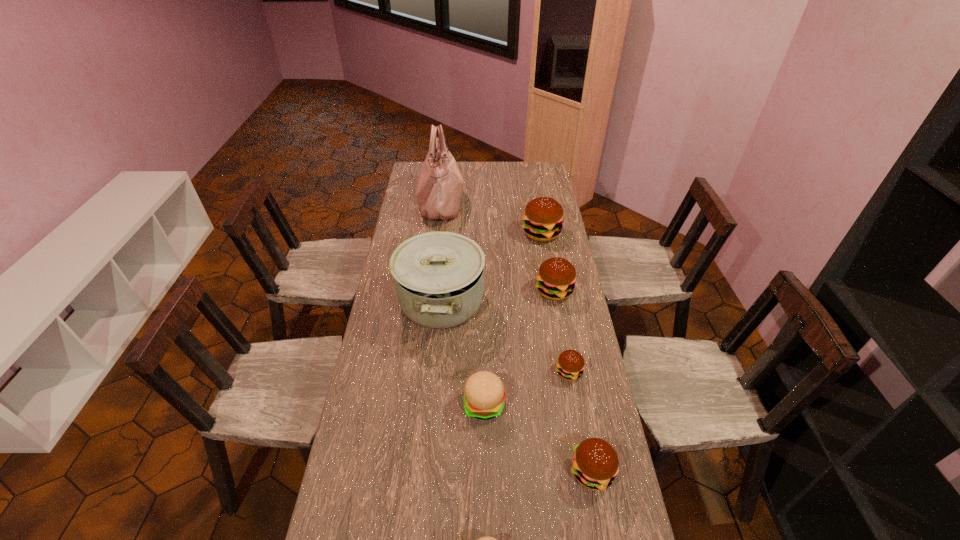
Locate an element on the screen. The height and width of the screenshot is (540, 960). object that is at the far edge is located at coordinates 440,185.

At what (x,y) coordinates should I click in order to perform the action: click on handbag located at the left edge. Please return your answer as a coordinate pair (x, y). Looking at the image, I should click on (440, 185).

At what (x,y) coordinates should I click in order to perform the action: click on saucepan that is at the left edge. Please return your answer as a coordinate pair (x, y). This screenshot has height=540, width=960. Looking at the image, I should click on (439, 276).

Locate an element on the screen. Image resolution: width=960 pixels, height=540 pixels. object that is at the far left corner is located at coordinates (440, 185).

Locate an element on the screen. This screenshot has height=540, width=960. vacant region at the left edge is located at coordinates (368, 391).

Where is `vacant space at the right edge of the desktop`? This screenshot has width=960, height=540. vacant space at the right edge of the desktop is located at coordinates (573, 264).

Image resolution: width=960 pixels, height=540 pixels. What are the coordinates of `vacant space at the far right corner of the desktop` in the screenshot? It's located at [529, 165].

Locate an element on the screen. This screenshot has width=960, height=540. unoccupied position between the second nearest hamburger and the fifth shortest hamburger is located at coordinates pyautogui.click(x=573, y=381).

The image size is (960, 540). Find the location of `free space between the smallest brown hamburger and the second nearest hamburger`. free space between the smallest brown hamburger and the second nearest hamburger is located at coordinates (581, 422).

Find the location of a particular element. free space between the tallest object and the fifth farthest hamburger is located at coordinates (516, 338).